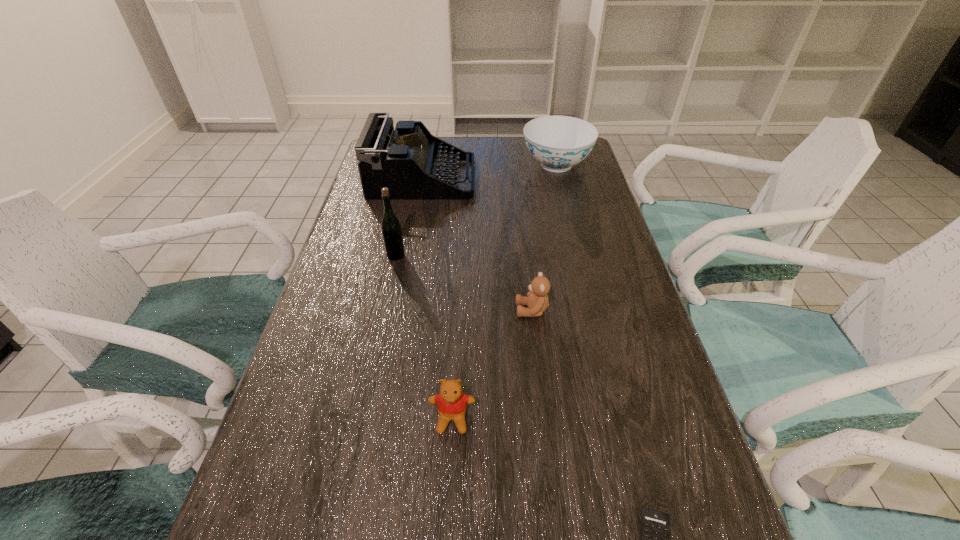
Where is `beer bottle`? The height and width of the screenshot is (540, 960). beer bottle is located at coordinates (391, 229).

Locate an element on the screen. typewriter is located at coordinates (413, 164).

Where is `the fourth shortest object`? the fourth shortest object is located at coordinates (557, 142).

This screenshot has width=960, height=540. Identify the location of the nearer teddy bear. (451, 402).

Where is `the second nearest object`? The width and height of the screenshot is (960, 540). the second nearest object is located at coordinates (451, 402).

Where is `the right teddy bear`? the right teddy bear is located at coordinates (537, 301).

The height and width of the screenshot is (540, 960). I want to click on the third nearest object, so click(x=537, y=301).

Where is `free region located on the front of the third farthest object`? free region located on the front of the third farthest object is located at coordinates (382, 320).

Image resolution: width=960 pixels, height=540 pixels. I want to click on free region located on the typing side of the fifth shortest object, so click(579, 179).

I want to click on vacant space situated on the front of the chinaware, so click(565, 200).